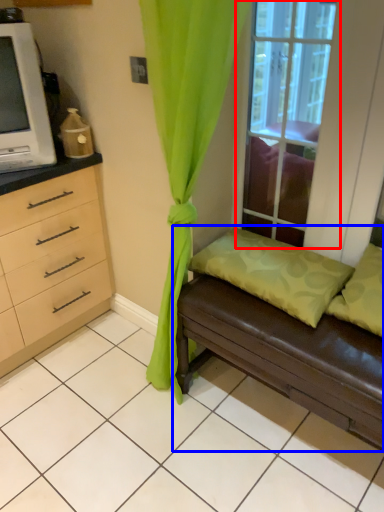
Question: Among these objects, which one is farthest to the camera, window (highlighted by a red box) or studio couch (highlighted by a blue box)?

Choices:
 (A) window
 (B) studio couch

Answer: (A)